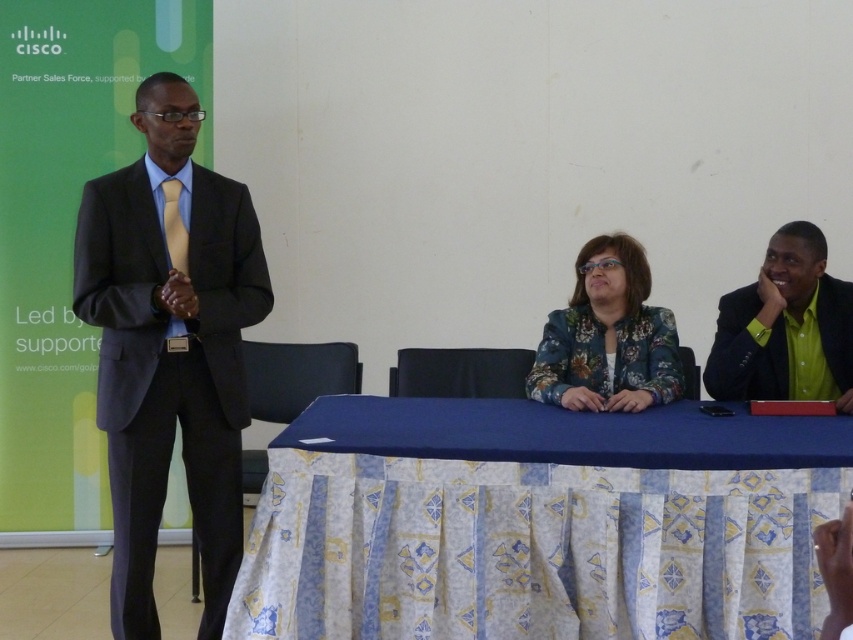
Question: Is green matte shirt at right to the left of yellow satin tie at left from the viewer's perspective?

Choices:
 (A) no
 (B) yes

Answer: (A)

Question: Which point appears farthest from the camera in this image?

Choices:
 (A) (653, 605)
 (B) (576, 346)
 (C) (167, 184)
 (D) (718, 390)

Answer: (B)

Question: Does matte black suit at left appear under yellow satin tie at left?

Choices:
 (A) yes
 (B) no

Answer: (A)

Question: Which point is farther to the camera?

Choices:
 (A) (766, 324)
 (B) (221, 484)
 (C) (596, 352)

Answer: (C)

Question: Which point is farther to the camera?

Choices:
 (A) blue fabric table at center
 (B) yellow satin tie at left
 (C) matte black suit at left

Answer: (B)

Question: Is green matte shirt at right to the right of yellow satin tie at left from the viewer's perspective?

Choices:
 (A) yes
 (B) no

Answer: (A)